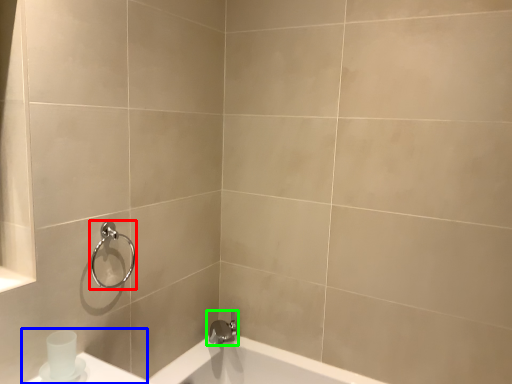
Question: Which is farther away from shower (highlighted by a red box)? sink (highlighted by a blue box) or tap (highlighted by a green box)?

Choices:
 (A) sink
 (B) tap

Answer: (B)